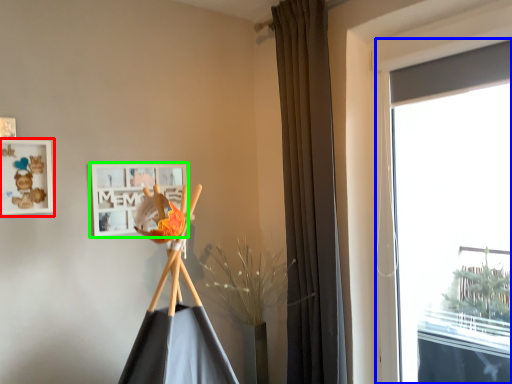
Question: Which is farther away from picture frame (highlighted by a red box)? window (highlighted by a blue box) or picture frame (highlighted by a green box)?

Choices:
 (A) window
 (B) picture frame

Answer: (A)